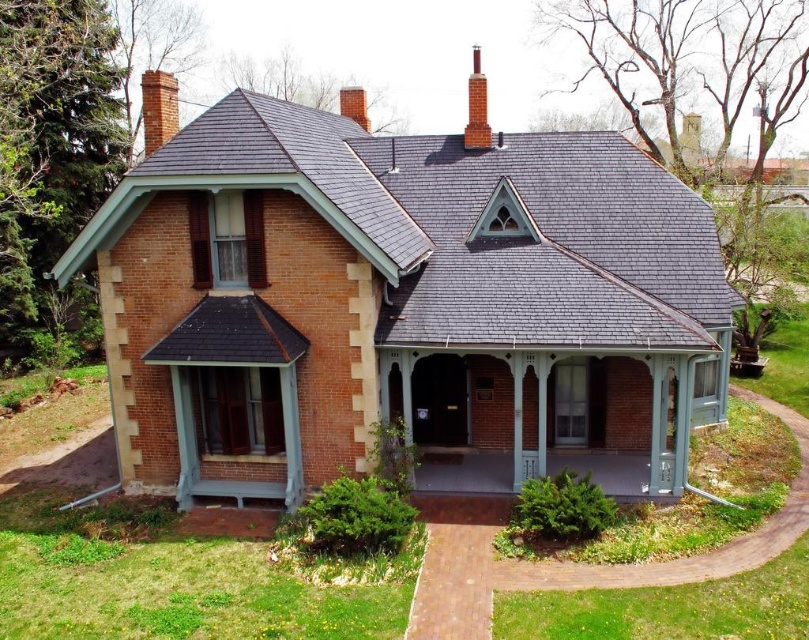
You are standing in front of the Victorian house and notice two points marked on the image. The first point is at coordinates point (x=646, y=460) and the second is at point (x=354, y=109). Which of these two points is closer to you?

Result: Point (x=646, y=460) is closer to you because it is in front of point (x=354, y=109).

You are standing in front of the house and want to reach the red brick chimney at upper center. Which direction should you look to find the smooth concrete porch at center?

The smooth concrete porch at center is below the red brick chimney at upper center, so you should look downward from the chimney to locate the porch.

You are a delivery person approaching the house and need to determine which object is taller between the smooth concrete porch at center and the brick chimney at upper left. Based on the scene, which one is taller?

The brick chimney at upper left is taller than the smooth concrete porch at center.